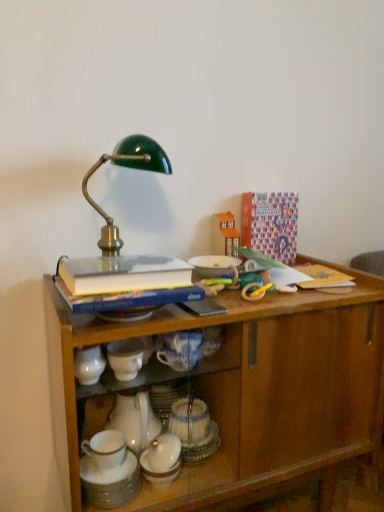
Question: Considering the positions of rubber yellow and blue teething ring at upper right, the 2th toy from the top, and white glossy cup at lower center in the image, is rubber yellow and blue teething ring at upper right, the 2th toy from the top, taller or shorter than white glossy cup at lower center?

Choices:
 (A) tall
 (B) short

Answer: (B)

Question: Does point (206, 286) appear closer or farther from the camera than point (139, 476)?

Choices:
 (A) closer
 (B) farther

Answer: (B)

Question: Based on their relative distances, which object is nearer to the white glossy cup at lower center?

Choices:
 (A) wooden toy house at upper center, the 1th toy viewed from the back
 (B) hardcover book at upper center
 (C) rubber yellow and blue teething ring at upper right, which appears as the first toy when viewed from the front
 (D) wooden cabinet at center

Answer: (D)

Question: Based on their relative distances, which object is farther from the wooden cabinet at center?

Choices:
 (A) hardcover book at upper center
 (B) rubber yellow and blue teething ring at upper right, the second toy from the back
 (C) white glossy cup at lower center
 (D) wooden toy house at upper center, arranged as the 1th toy when viewed from the top

Answer: (D)